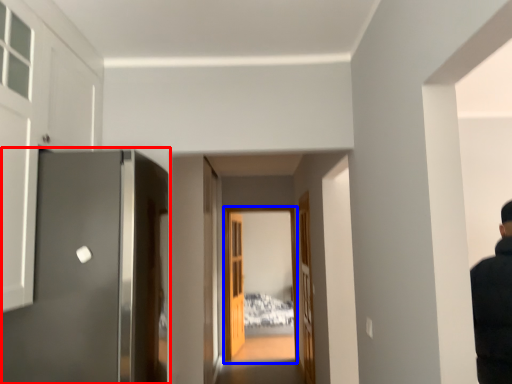
Question: Which object appears closest to the camera in this image, door (highlighted by a red box) or glass door (highlighted by a blue box)?

Choices:
 (A) door
 (B) glass door

Answer: (A)